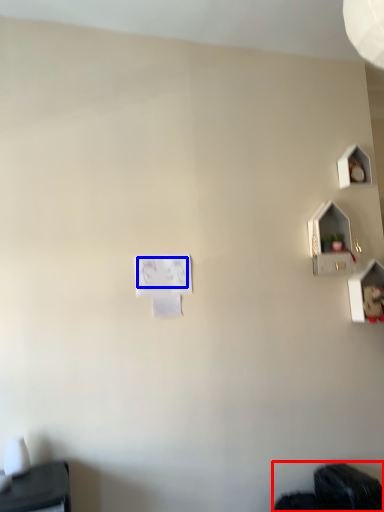
Question: Which of the following is the farthest to the observer, wide (highlighted by a red box) or writing (highlighted by a blue box)?

Choices:
 (A) wide
 (B) writing

Answer: (B)